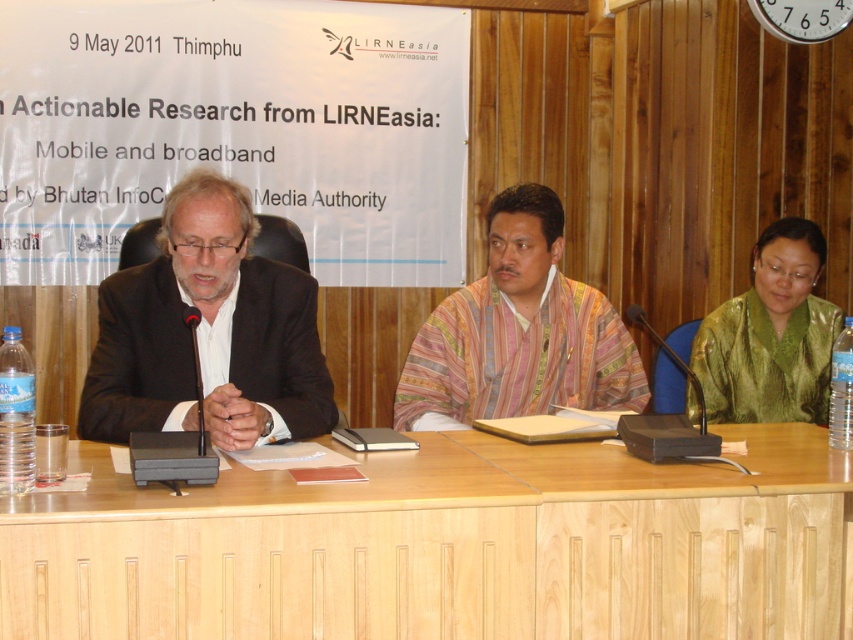
You are attending the event and want to take a photo of the black matte suit at left and the multicolored woven fabric at center. Which one will appear larger in your photo?

The black matte suit at left will appear larger in your photo because it is closer to the viewer than the multicolored woven fabric at center.

You are standing at the entrance of the room and want to approach the light brown wood table at center. Based on the coordinates given, in which direction should you move relative to your current position?

The light brown wood table at center is located at coordinates point [445,547], so you should move forward and to the right from your current position at the entrance to reach it.

You are organizing a photoshoot and need to place a large poster behind the multicolored woven fabric at center and the green silk jacket at right. Based on their sizes, which object should the poster be placed behind to ensure it is visible?

The multicolored woven fabric at center has a larger size compared to the green silk jacket at right, so the poster should be placed behind the multicolored woven fabric at center to ensure visibility.